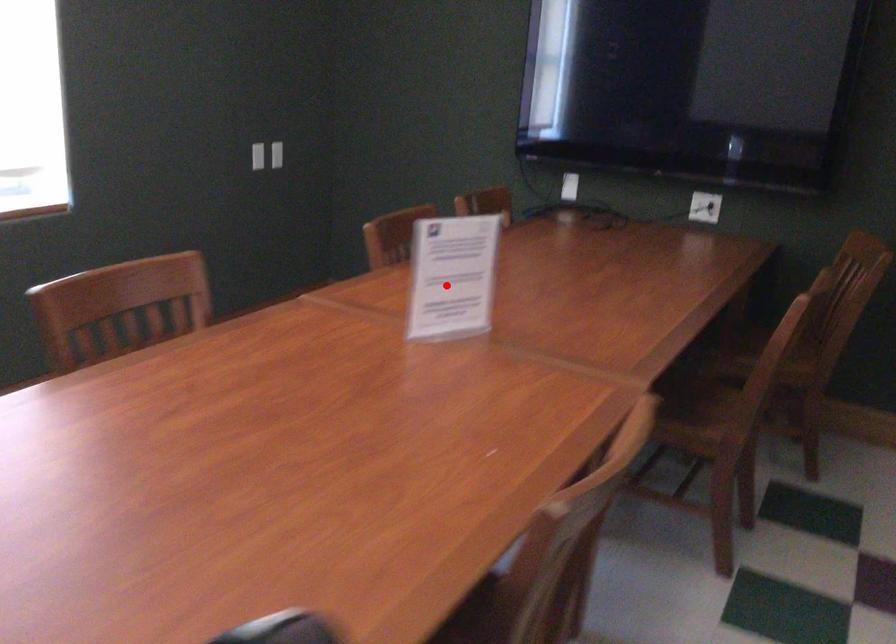
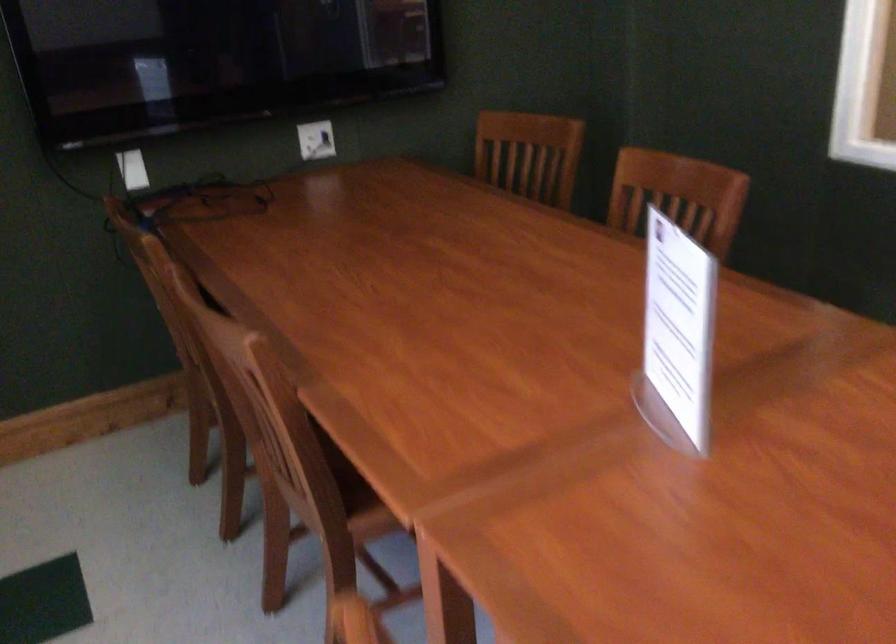
Question: I am providing you with two images of the same scene from different viewpoints. Given a red point in image1, look at the same physical point in image2. Is it:

Choices:
 (A) Closer to the viewpoint
 (B) Farther from the viewpoint

Answer: (A)